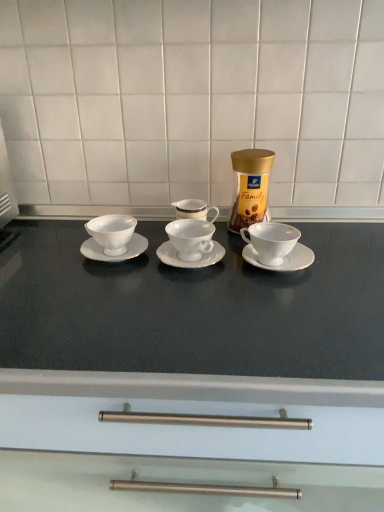
Question: From the image's perspective, does white porcelain cup at right, acting as the 1th coffee cup starting from the right, appear lower than matte white countertop at center?

Choices:
 (A) yes
 (B) no

Answer: (B)

Question: Is white porcelain cup at right, acting as the 1th coffee cup starting from the right, surrounding matte white countertop at center?

Choices:
 (A) yes
 (B) no

Answer: (B)

Question: Does white porcelain cup at right, marked as the 3th coffee cup in a left-to-right arrangement, have a larger size compared to matte white countertop at center?

Choices:
 (A) no
 (B) yes

Answer: (A)

Question: Considering the relative sizes of white porcelain cup at right, marked as the 3th coffee cup in a left-to-right arrangement, and matte white countertop at center in the image provided, is white porcelain cup at right, marked as the 3th coffee cup in a left-to-right arrangement, smaller than matte white countertop at center?

Choices:
 (A) yes
 (B) no

Answer: (A)

Question: Is white porcelain cup at right, marked as the 3th coffee cup in a left-to-right arrangement, at the left side of matte white countertop at center?

Choices:
 (A) yes
 (B) no

Answer: (B)

Question: Considering the positions of matte white countertop at center and gold metallic jar at center in the image, is matte white countertop at center bigger or smaller than gold metallic jar at center?

Choices:
 (A) small
 (B) big

Answer: (B)

Question: From the image's perspective, is matte white countertop at center above or below gold metallic jar at center?

Choices:
 (A) above
 (B) below

Answer: (B)

Question: Visually, is matte white countertop at center positioned to the left or to the right of gold metallic jar at center?

Choices:
 (A) left
 (B) right

Answer: (A)

Question: From their relative heights in the image, would you say matte white countertop at center is taller or shorter than gold metallic jar at center?

Choices:
 (A) short
 (B) tall

Answer: (B)

Question: From a real-world perspective, is white porcelain cup at right, marked as the 3th coffee cup in a left-to-right arrangement, positioned above or below gold metallic jar at center?

Choices:
 (A) above
 (B) below

Answer: (B)

Question: Considering the positions of point (274, 249) and point (246, 202), is point (274, 249) closer or farther from the camera than point (246, 202)?

Choices:
 (A) farther
 (B) closer

Answer: (B)

Question: In the image, is white porcelain cup at right, marked as the 3th coffee cup in a left-to-right arrangement, positioned in front of or behind gold metallic jar at center?

Choices:
 (A) behind
 (B) front

Answer: (B)

Question: In terms of height, does white porcelain cup at right, acting as the 1th coffee cup starting from the right, look taller or shorter compared to gold metallic jar at center?

Choices:
 (A) tall
 (B) short

Answer: (B)

Question: Is white ceramic saucer at right, marked as the 3th saucer in a left-to-right arrangement, in front of or behind white porcelain cup at left, marked as the 3th coffee cup in a right-to-left arrangement, in the image?

Choices:
 (A) front
 (B) behind

Answer: (A)

Question: In terms of height, does white ceramic saucer at right, positioned as the first saucer in right-to-left order, look taller or shorter compared to white porcelain cup at left, the first coffee cup from the left?

Choices:
 (A) short
 (B) tall

Answer: (A)